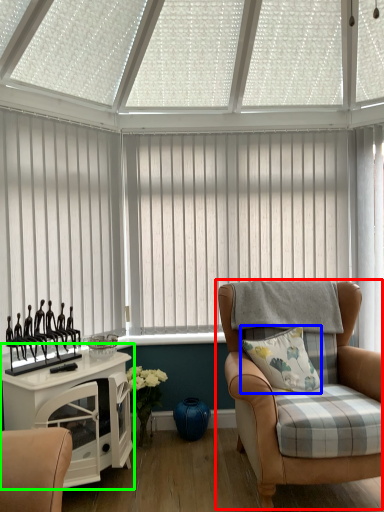
Question: Which object is the closest to the chair (highlighted by a red box)? Choose among these: pillow (highlighted by a blue box) or table (highlighted by a green box).

Choices:
 (A) pillow
 (B) table

Answer: (A)